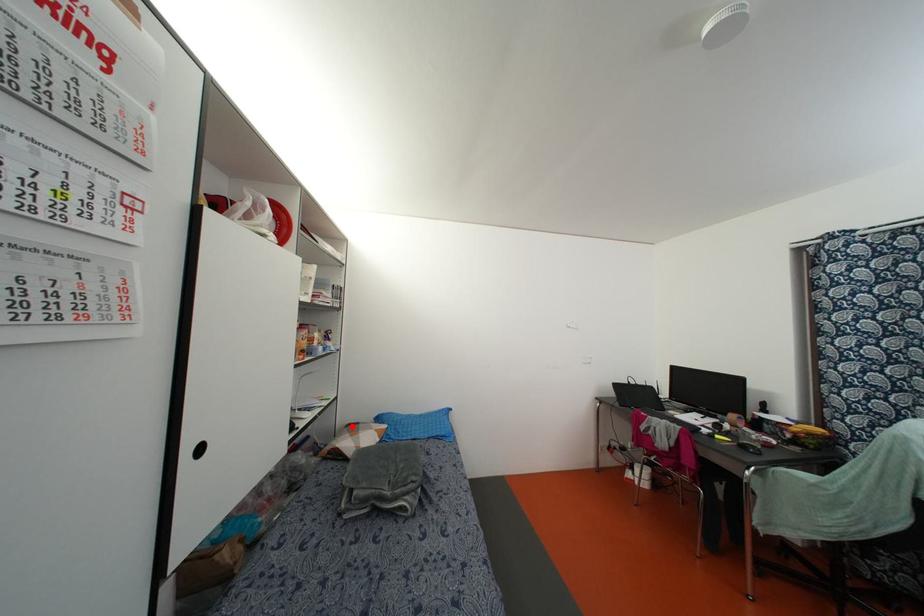
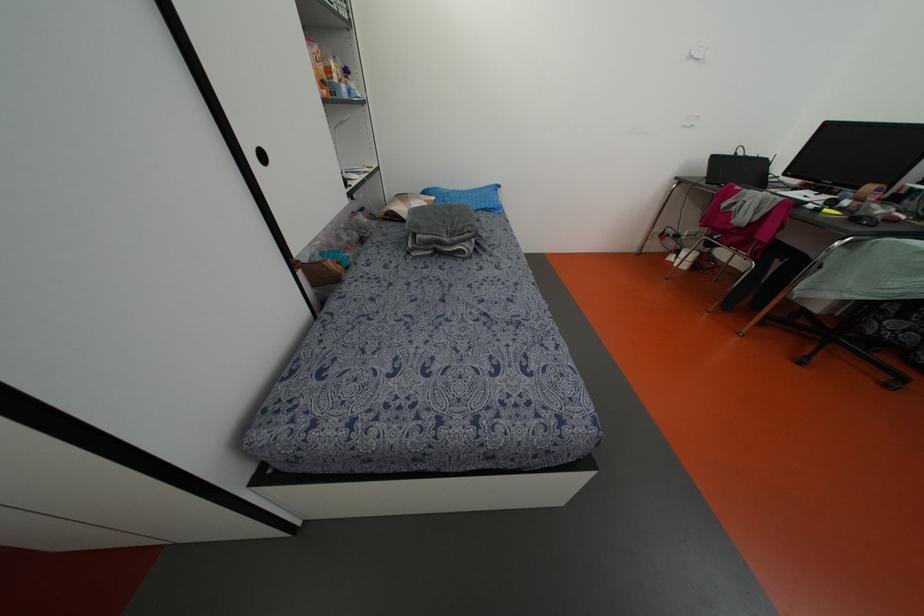
In the second image, find the point that corresponds to the highlighted location in the first image.

(402, 197)